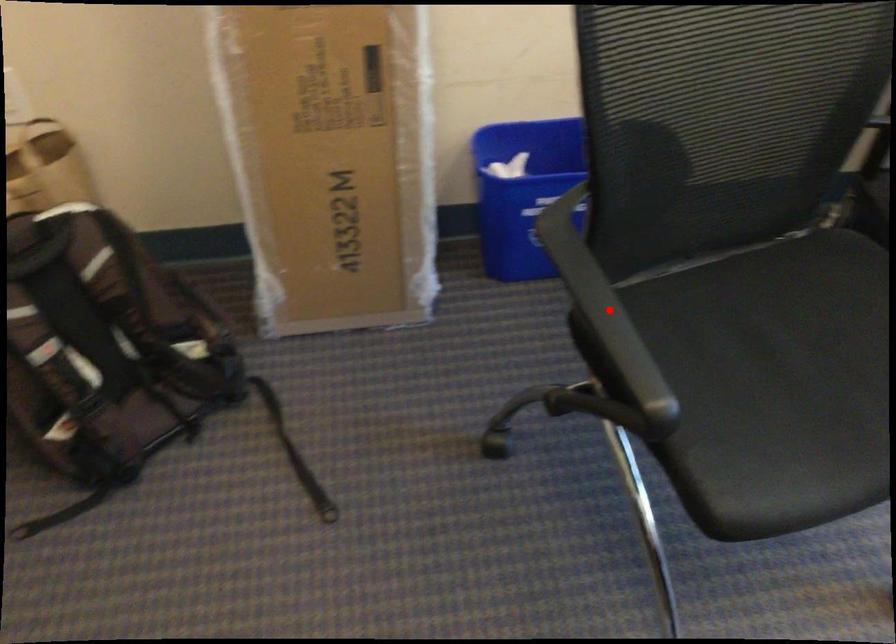
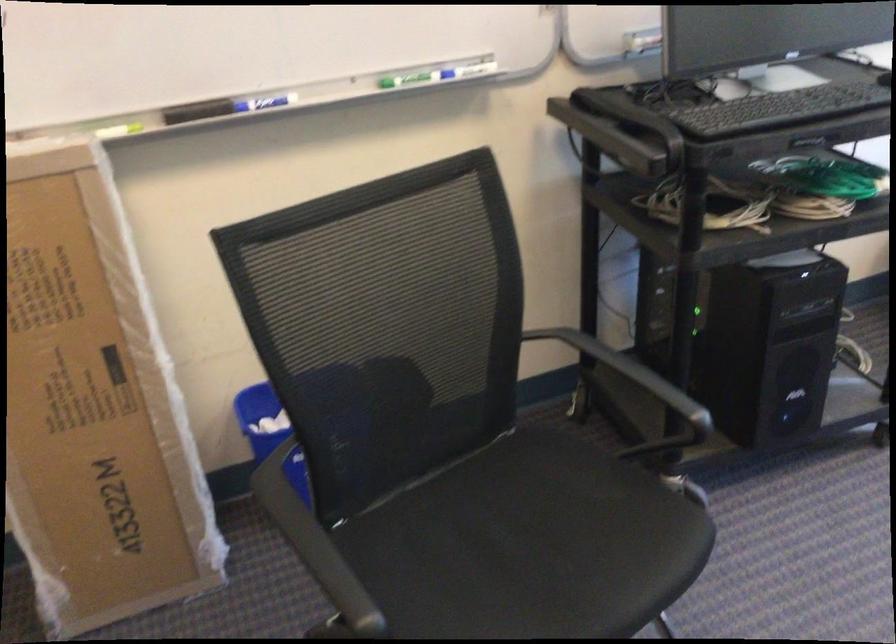
Question: I am providing you with two images of the same scene from different viewpoints. Given a red point in image1, look at the same physical point in image2. Is it:

Choices:
 (A) Closer to the viewpoint
 (B) Farther from the viewpoint

Answer: (B)